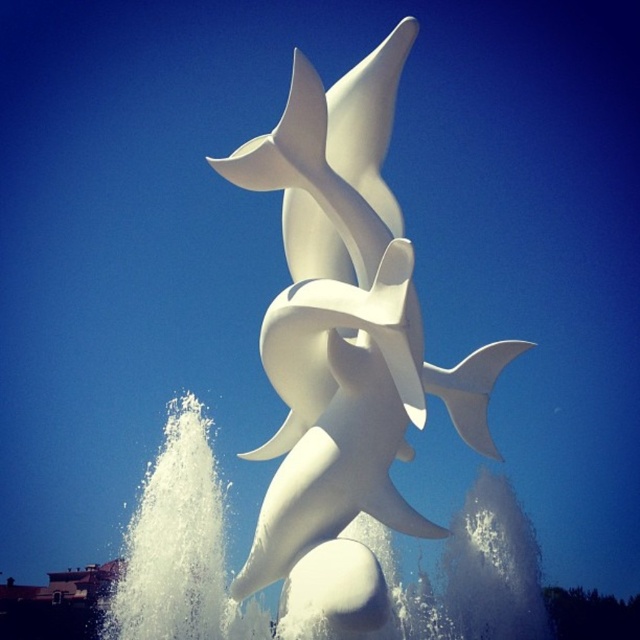
Does white glossy dolphins at center appear on the left side of white frothy water at center?

Incorrect, white glossy dolphins at center is not on the left side of white frothy water at center.

Which is in front, point (332, 138) or point (538, 593)?

Point (332, 138) is in front.

The width and height of the screenshot is (640, 640). What do you see at coordinates (344, 337) in the screenshot?
I see `white glossy dolphins at center` at bounding box center [344, 337].

The width and height of the screenshot is (640, 640). What are the coordinates of `white glossy dolphins at center` in the screenshot? It's located at coord(344,337).